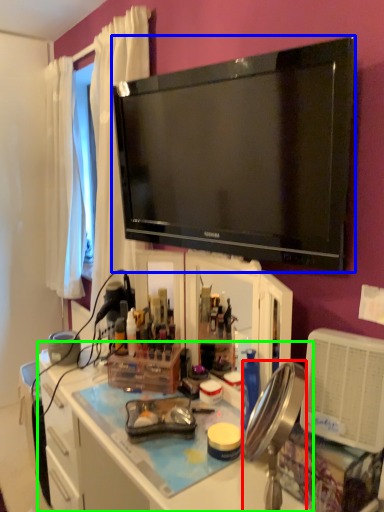
Question: Based on their relative distances, which object is nearer to mirror (highlighted by a red box)? Choose from television (highlighted by a blue box) and desk (highlighted by a green box).

Choices:
 (A) television
 (B) desk

Answer: (B)